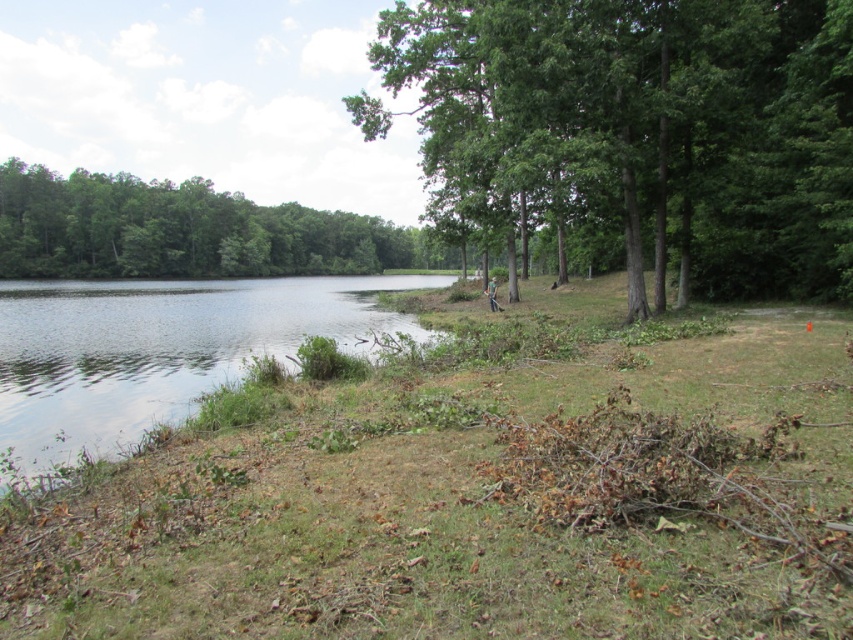
You are planning to plant a new tree in the lakeside area. The new tree will be the same size as the green leafy tree at left. Where should you plant it so that it doesn not block the view of the lake from the green leafy tree at center?

You should plant the new tree at the left position, as the green leafy tree at center is larger and will block the view if the new tree is placed there. Since the new tree is the same size as the green leafy tree at left, placing it in the left position ensures it won not obstruct the view from the larger tree at center.

You are a landscape architect planning to plant a new tree in this lakeside area. You notice the green leafy tree at center and the green leafy tree at left. Which tree has a narrower width, and why would that matter for your planting plan?

The green leafy tree at center has a narrower width than the green leafy tree at left. This matters because choosing a tree with a narrower width could help in spacing considerations, ensuring adequate space between trees for growth and maintaining the aesthetic balance of the lakeside area.